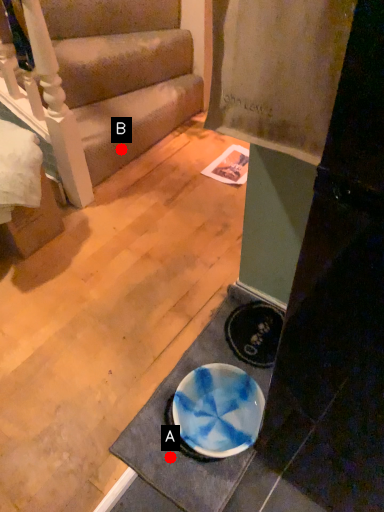
Question: Two points are circled on the image, labeled by A and B beside each circle. Which point is closer to the camera?

Choices:
 (A) A is closer
 (B) B is closer

Answer: (A)